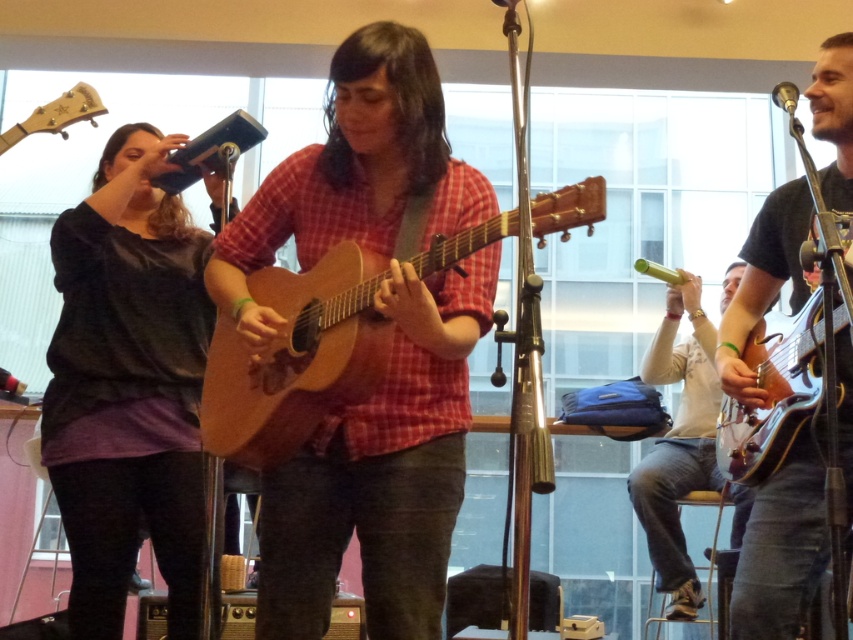
Between point (440, 184) and point (314, 294), which one is positioned in front?

Point (314, 294) is more forward.

Is point (312, 209) closer to camera compared to point (202, 397)?

Yes.

Identify the location of wooden acoustic guitar at center. (392, 346).

Which is more to the left, dark gray shirt at left or matte black guitar at right?

dark gray shirt at left

How much distance is there between dark gray shirt at left and matte black guitar at right?

dark gray shirt at left and matte black guitar at right are 1.40 meters apart from each other.

Is point (142, 204) farther from viewer compared to point (759, 596)?

Yes, it is.

This screenshot has height=640, width=853. What are the coordinates of `dark gray shirt at left` in the screenshot? It's located at (x=128, y=387).

The image size is (853, 640). Describe the element at coordinates (296, 356) in the screenshot. I see `natural wood acoustic guitar at center` at that location.

Can you confirm if natural wood acoustic guitar at center is taller than wooden acoustic guitar at right?

In fact, natural wood acoustic guitar at center may be shorter than wooden acoustic guitar at right.

This screenshot has width=853, height=640. Describe the element at coordinates (296, 356) in the screenshot. I see `natural wood acoustic guitar at center` at that location.

Find the location of `natural wood acoustic guitar at center`. natural wood acoustic guitar at center is located at coordinates (296, 356).